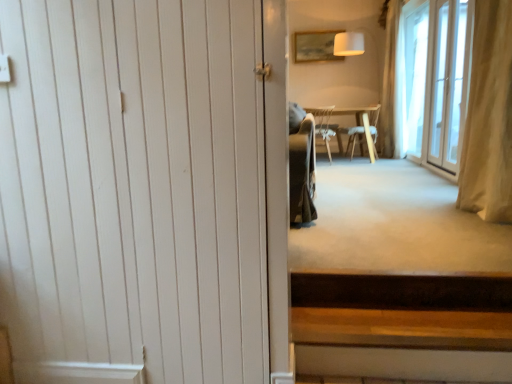
Question: Is white wood door at left smaller than light brown wooden chair at center, positioned as the second chair in left-to-right order?

Choices:
 (A) no
 (B) yes

Answer: (B)

Question: From the image's perspective, is white wood door at left beneath light brown wooden chair at center, positioned as the second chair in left-to-right order?

Choices:
 (A) yes
 (B) no

Answer: (A)

Question: Are white wood door at left and light brown wooden chair at center, the first chair viewed from the right, making contact?

Choices:
 (A) yes
 (B) no

Answer: (B)

Question: Can you confirm if white wood door at left is positioned to the left of light brown wooden chair at center, the first chair viewed from the right?

Choices:
 (A) yes
 (B) no

Answer: (A)

Question: Can you confirm if white wood door at left is positioned to the right of light brown wooden chair at center, the first chair viewed from the right?

Choices:
 (A) yes
 (B) no

Answer: (B)

Question: Is white sheer curtain at right, which appears as the 1th curtain when viewed from the right, wider or thinner than transparent glass door at right?

Choices:
 (A) wide
 (B) thin

Answer: (A)

Question: Considering the relative positions of white sheer curtain at right, which appears as the 1th curtain when viewed from the right, and transparent glass door at right in the image provided, is white sheer curtain at right, which appears as the 1th curtain when viewed from the right, to the left or to the right of transparent glass door at right?

Choices:
 (A) right
 (B) left

Answer: (B)

Question: Is white sheer curtain at right, which appears as the 1th curtain when viewed from the right, in front of or behind transparent glass door at right in the image?

Choices:
 (A) behind
 (B) front

Answer: (A)

Question: From a real-world perspective, is white sheer curtain at right, marked as the 2th curtain in a left-to-right arrangement, above or below transparent glass door at right?

Choices:
 (A) above
 (B) below

Answer: (A)

Question: Visually, is light brown wooden chair at center, the first chair viewed from the right, positioned to the left or to the right of transparent glass door at right?

Choices:
 (A) left
 (B) right

Answer: (A)

Question: Considering their positions, is light brown wooden chair at center, the first chair viewed from the right, located in front of or behind transparent glass door at right?

Choices:
 (A) behind
 (B) front

Answer: (A)

Question: Does point (371, 152) appear closer or farther from the camera than point (422, 6)?

Choices:
 (A) closer
 (B) farther

Answer: (B)

Question: From their relative heights in the image, would you say light brown wooden chair at center, positioned as the second chair in left-to-right order, is taller or shorter than transparent glass door at right?

Choices:
 (A) tall
 (B) short

Answer: (B)

Question: Relative to matte wooden picture frame at upper center, is beige fabric curtain at right, which is the first curtain from left to right, in front or behind?

Choices:
 (A) front
 (B) behind

Answer: (A)

Question: Visually, is beige fabric curtain at right, arranged as the first curtain when viewed from the front, positioned to the left or to the right of matte wooden picture frame at upper center?

Choices:
 (A) right
 (B) left

Answer: (A)